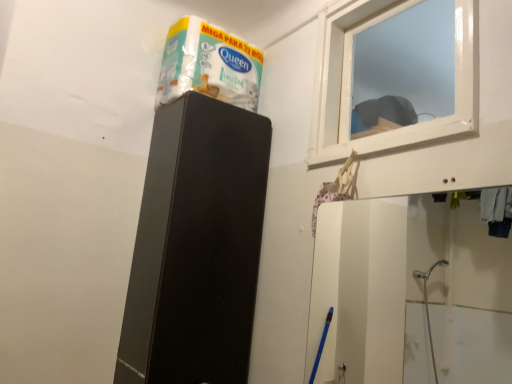
Question: From the image's perspective, does black matte speaker at upper center appear lower than white glossy tissue box at upper center?

Choices:
 (A) yes
 (B) no

Answer: (A)

Question: Could you tell me if black matte speaker at upper center is facing white glossy tissue box at upper center?

Choices:
 (A) no
 (B) yes

Answer: (A)

Question: Is black matte speaker at upper center placed right next to white glossy tissue box at upper center?

Choices:
 (A) yes
 (B) no

Answer: (B)

Question: Is white glossy tissue box at upper center located within black matte speaker at upper center?

Choices:
 (A) no
 (B) yes

Answer: (A)

Question: From a real-world perspective, is black matte speaker at upper center located higher than white glossy tissue box at upper center?

Choices:
 (A) yes
 (B) no

Answer: (B)

Question: Is white glossy tissue box at upper center inside the boundaries of transparent plastic window at upper right, or outside?

Choices:
 (A) outside
 (B) inside

Answer: (A)

Question: Is white glossy tissue box at upper center wider or thinner than transparent plastic window at upper right?

Choices:
 (A) thin
 (B) wide

Answer: (B)

Question: Is white glossy tissue box at upper center taller or shorter than transparent plastic window at upper right?

Choices:
 (A) short
 (B) tall

Answer: (A)

Question: From the image's perspective, relative to transparent plastic window at upper right, is white glossy tissue box at upper center above or below?

Choices:
 (A) below
 (B) above

Answer: (B)

Question: From a real-world perspective, is transparent plastic window at upper right positioned above or below white glossy tissue box at upper center?

Choices:
 (A) above
 (B) below

Answer: (B)

Question: Is transparent plastic window at upper right situated inside white glossy tissue box at upper center or outside?

Choices:
 (A) outside
 (B) inside

Answer: (A)

Question: Based on their positions, is transparent plastic window at upper right located to the left or right of white glossy tissue box at upper center?

Choices:
 (A) right
 (B) left

Answer: (A)

Question: In terms of width, does transparent plastic window at upper right look wider or thinner when compared to white glossy tissue box at upper center?

Choices:
 (A) thin
 (B) wide

Answer: (A)

Question: Choose the correct answer: Is transparent plastic window at upper right inside black matte speaker at upper center or outside it?

Choices:
 (A) outside
 (B) inside

Answer: (A)

Question: From the image's perspective, is transparent plastic window at upper right above or below black matte speaker at upper center?

Choices:
 (A) below
 (B) above

Answer: (B)